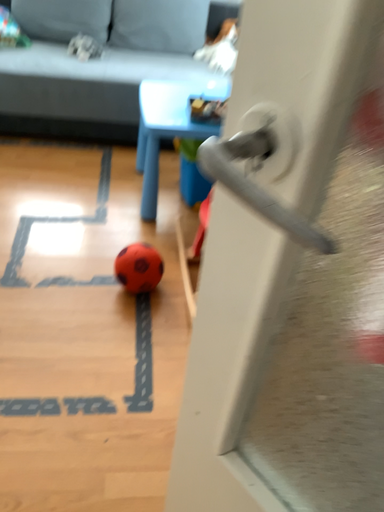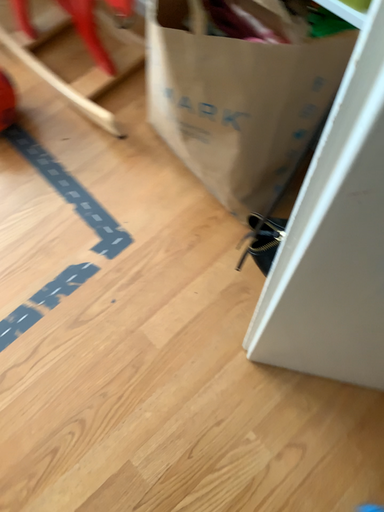
Question: How did the camera likely rotate when shooting the video?

Choices:
 (A) rotated right
 (B) rotated left

Answer: (A)